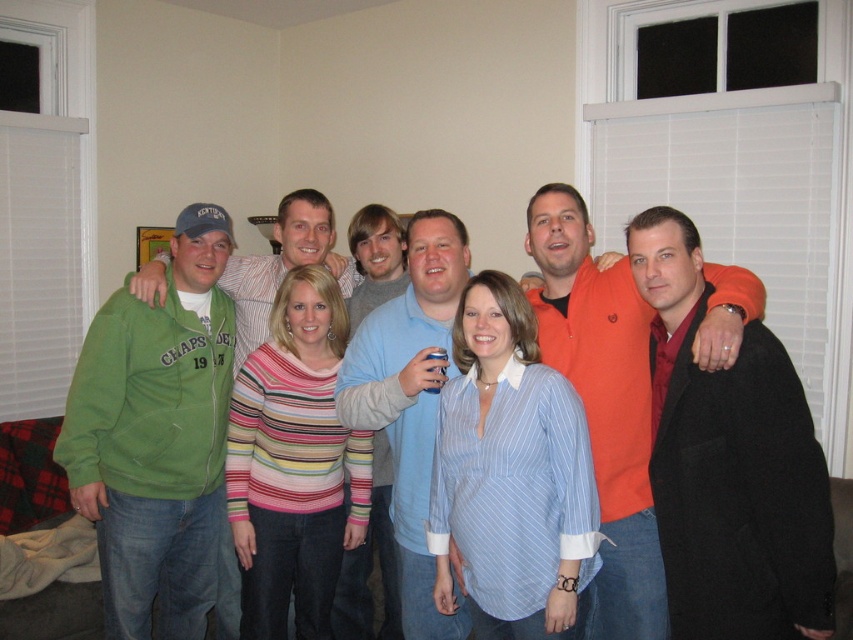
How far apart are striped knit sweater at center and light blue cotton shirt at center?

The distance of striped knit sweater at center from light blue cotton shirt at center is 12.23 inches.

Locate an element on the screen. The width and height of the screenshot is (853, 640). striped knit sweater at center is located at coordinates (294, 464).

Where is `striped knit sweater at center`? striped knit sweater at center is located at coordinates (294, 464).

What do you see at coordinates (509, 474) in the screenshot? This screenshot has height=640, width=853. I see `blue striped shirt at center` at bounding box center [509, 474].

Does blue striped shirt at center have a greater width compared to light blue cotton shirt at center?

Yes, blue striped shirt at center is wider than light blue cotton shirt at center.

Is point (567, 605) positioned before point (352, 422)?

Yes, point (567, 605) is closer to viewer.

Where is `blue striped shirt at center`? blue striped shirt at center is located at coordinates (509, 474).

Is point (296, 346) farther from viewer compared to point (640, 387)?

Yes, it is.

Image resolution: width=853 pixels, height=640 pixels. What do you see at coordinates (294, 464) in the screenshot?
I see `striped knit sweater at center` at bounding box center [294, 464].

This screenshot has height=640, width=853. I want to click on striped knit sweater at center, so click(x=294, y=464).